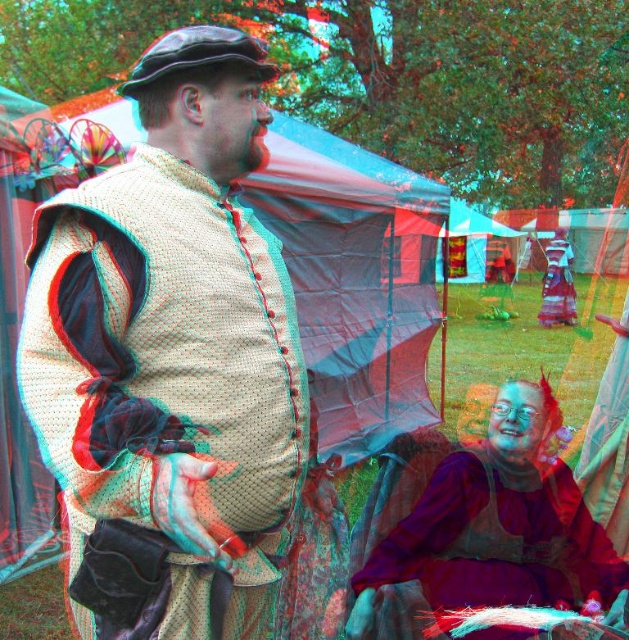
You are a GUI agent. You are given a task and a screenshot of the screen. Output one action in this format:
    pyautogui.click(x=<x>, y=<y>)
    Task: Click on the matte beige vest at center
    
    Given the screenshot: What is the action you would take?
    pyautogui.click(x=174, y=365)

Describe the element at coordinates (174, 365) in the screenshot. The width and height of the screenshot is (629, 640). I see `matte beige vest at center` at that location.

Identify the location of matte beige vest at center. This screenshot has height=640, width=629. (174, 365).

What do you see at coordinates (174, 365) in the screenshot? I see `matte beige vest at center` at bounding box center [174, 365].

Which of these two, matte beige vest at center or purple velvet dress at lower right, stands shorter?

purple velvet dress at lower right is shorter.

Does point (192, 51) come behind point (525, 557)?

No.

Locate an element on the screen. This screenshot has width=629, height=640. matte beige vest at center is located at coordinates (174, 365).

Does blue tarpaulin tent at center have a larger size compared to matte purple dress at lower right?

Yes.

Does blue tarpaulin tent at center lie in front of matte purple dress at lower right?

That is True.

Identify the location of blue tarpaulin tent at center. The image size is (629, 640). (476, 237).

In order to click on blue tarpaulin tent at center in this screenshot , I will do `click(476, 237)`.